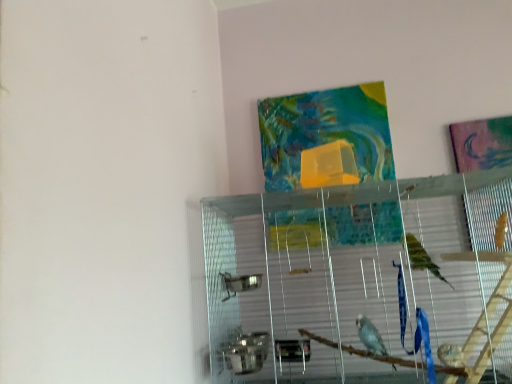
Where is `clear glass cage at center`? The width and height of the screenshot is (512, 384). clear glass cage at center is located at coordinates (361, 281).

Describe the element at coordinates (361, 281) in the screenshot. Image resolution: width=512 pixels, height=384 pixels. I see `clear glass cage at center` at that location.

Describe the element at coordinates (326, 138) in the screenshot. The image size is (512, 384). I see `textured fabric tapestry at upper center` at that location.

This screenshot has height=384, width=512. I want to click on textured fabric tapestry at upper center, so click(326, 138).

Locate an element on the screen. The image size is (512, 384). clear glass cage at center is located at coordinates (361, 281).

Which object is positioned more to the left, textured fabric tapestry at upper center or clear glass cage at center?

textured fabric tapestry at upper center.

In the image, is textured fabric tapestry at upper center positioned in front of or behind clear glass cage at center?

Visually, textured fabric tapestry at upper center is located behind clear glass cage at center.

Is point (376, 84) farther from camera compared to point (269, 382)?

Yes, point (376, 84) is behind point (269, 382).

In the scene shown: From the image's perspective, which is above, textured fabric tapestry at upper center or clear glass cage at center?

From the image's view, textured fabric tapestry at upper center is above.

Looking at this image, from a real-world perspective, which is physically below, textured fabric tapestry at upper center or clear glass cage at center?

clear glass cage at center.

Which of these two, textured fabric tapestry at upper center or clear glass cage at center, is thinner?

Thinner between the two is textured fabric tapestry at upper center.

Is textured fabric tapestry at upper center taller or shorter than clear glass cage at center?

textured fabric tapestry at upper center is shorter than clear glass cage at center.

Consider the image. Considering the sizes of objects textured fabric tapestry at upper center and clear glass cage at center in the image provided, who is bigger, textured fabric tapestry at upper center or clear glass cage at center?

With larger size is clear glass cage at center.

From the picture: Is clear glass cage at center a part of textured fabric tapestry at upper center?

No, clear glass cage at center is located outside of textured fabric tapestry at upper center.

Is textured fabric tapestry at upper center positioned far away from clear glass cage at center?

textured fabric tapestry at upper center is near clear glass cage at center, not far away.

Is clear glass cage at center at the back of textured fabric tapestry at upper center?

textured fabric tapestry at upper center does not have its back to clear glass cage at center.

What are the coordinates of `tapestry behind the clear glass cage at center` in the screenshot? It's located at tap(326, 138).

Which is more to the right, clear glass cage at center or textured fabric tapestry at upper center?

clear glass cage at center.

Which object is closer to the camera, clear glass cage at center or textured fabric tapestry at upper center?

clear glass cage at center.

Considering the positions of points (331, 344) and (393, 176), is point (331, 344) closer to camera compared to point (393, 176)?

Yes, it is in front of point (393, 176).

From the image's perspective, is clear glass cage at center below textured fabric tapestry at upper center?

Indeed, from the image's perspective, clear glass cage at center is shown beneath textured fabric tapestry at upper center.

From a real-world perspective, which is physically above, clear glass cage at center or textured fabric tapestry at upper center?

In real-world perspective, textured fabric tapestry at upper center is above.

Is clear glass cage at center wider or thinner than textured fabric tapestry at upper center?

Clearly, clear glass cage at center has more width compared to textured fabric tapestry at upper center.

Can you confirm if clear glass cage at center is taller than textured fabric tapestry at upper center?

Yes, clear glass cage at center is taller than textured fabric tapestry at upper center.

Between clear glass cage at center and textured fabric tapestry at upper center, which one has larger size?

clear glass cage at center is bigger.

Is clear glass cage at center inside or outside of textured fabric tapestry at upper center?

clear glass cage at center lies outside textured fabric tapestry at upper center.

Is clear glass cage at center far from textured fabric tapestry at upper center?

clear glass cage at center is near textured fabric tapestry at upper center, not far away.

Is clear glass cage at center positioned with its back to textured fabric tapestry at upper center?

No, clear glass cage at center's orientation is not away from textured fabric tapestry at upper center.

How much distance is there between clear glass cage at center and textured fabric tapestry at upper center?

They are 18.29 centimeters apart.

This screenshot has width=512, height=384. I want to click on glass box lying in front of the textured fabric tapestry at upper center, so click(x=361, y=281).

Find the location of a particular element. This screenshot has width=512, height=384. tapestry above the clear glass cage at center (from the image's perspective) is located at coordinates (326, 138).

Locate an element on the screen. The height and width of the screenshot is (384, 512). tapestry on the left of clear glass cage at center is located at coordinates point(326,138).